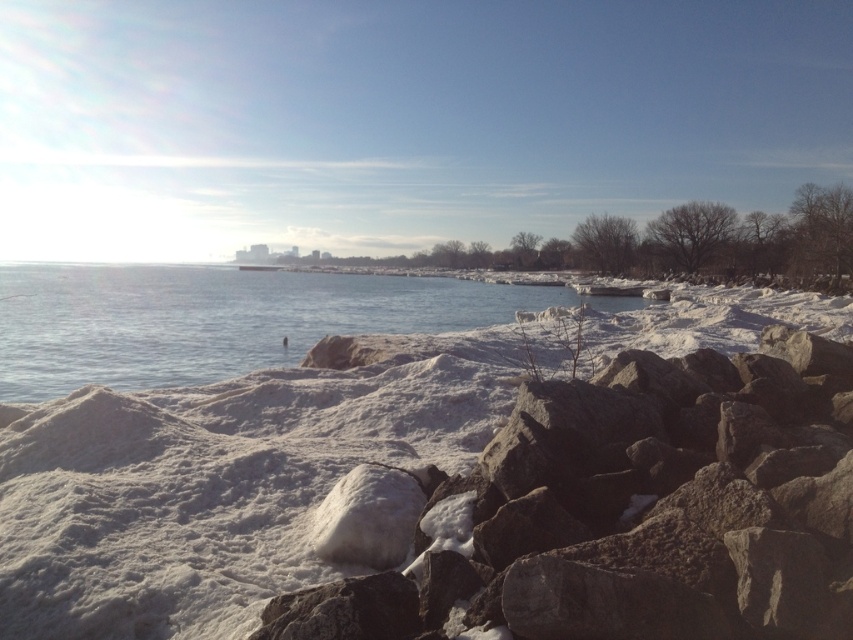
Question: Is white fluffy snow at lower left thinner than clear water at center?

Choices:
 (A) yes
 (B) no

Answer: (A)

Question: Which point is closer to the camera taking this photo?

Choices:
 (A) (494, 312)
 (B) (82, 561)

Answer: (B)

Question: Is white fluffy snow at lower left above clear water at center?

Choices:
 (A) yes
 (B) no

Answer: (B)

Question: Which of the following is the farthest from the observer?

Choices:
 (A) (543, 440)
 (B) (35, 298)

Answer: (B)

Question: Observing the image, what is the correct spatial positioning of white fluffy snow at lower left in reference to clear water at center?

Choices:
 (A) below
 (B) above

Answer: (A)

Question: Among these points, which one is farthest from the camera?

Choices:
 (A) (171, 515)
 (B) (567, 292)

Answer: (B)